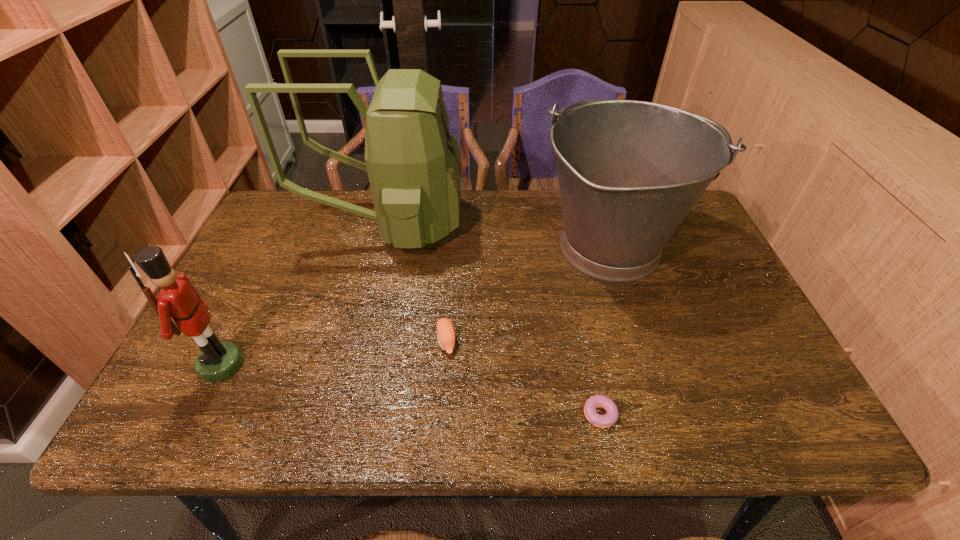
Find the location of a particular element. the tallest object is located at coordinates (414, 165).

Find the location of a particular element. bucket is located at coordinates (629, 172).

Where is `nutcracker`? This screenshot has height=540, width=960. nutcracker is located at coordinates (218, 360).

Identify the location of sushi. This screenshot has width=960, height=540. (445, 331).

This screenshot has height=540, width=960. I want to click on the shortest object, so click(603, 421).

Find the location of `doughnut`. doughnut is located at coordinates (603, 421).

Identify the location of blank space located on the front pocket of the backpack. (512, 224).

This screenshot has width=960, height=540. In order to click on vacant space located on the left of the bucket in this screenshot , I will do 475,247.

Locate an element on the screen. The width and height of the screenshot is (960, 540). free space located 0.360m on the front-facing side of the nutcracker is located at coordinates (403, 364).

This screenshot has height=540, width=960. In order to click on vacant area located 0.260m on the left of the sushi in this screenshot , I will do `click(325, 341)`.